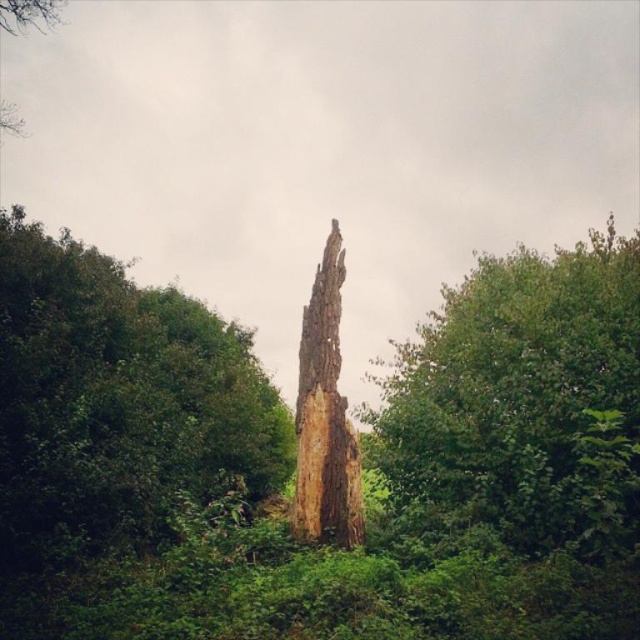
Question: Does rough bark tree at center appear under smooth brown tree trunk at center?

Choices:
 (A) no
 (B) yes

Answer: (B)

Question: Among these objects, which one is nearest to the camera?

Choices:
 (A) brown rough tree trunk at center
 (B) smooth brown tree trunk at center
 (C) rough bark tree at center

Answer: (B)

Question: From the image, what is the correct spatial relationship of rough bark tree at center in relation to brown rough tree trunk at center?

Choices:
 (A) below
 (B) above

Answer: (B)

Question: Can you confirm if rough bark tree at center is wider than brown rough tree trunk at center?

Choices:
 (A) no
 (B) yes

Answer: (B)

Question: Which of the following is the farthest from the observer?

Choices:
 (A) smooth brown tree trunk at center
 (B) brown rough tree trunk at center
 (C) rough bark tree at center

Answer: (B)

Question: Estimate the real-world distances between objects in this image. Which object is farther from the smooth brown tree trunk at center?

Choices:
 (A) brown rough tree trunk at center
 (B) rough bark tree at center

Answer: (B)